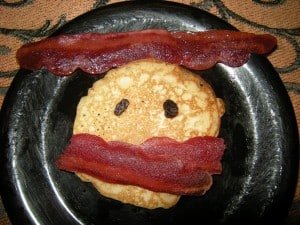
I want to click on fabric, so click(x=260, y=12).